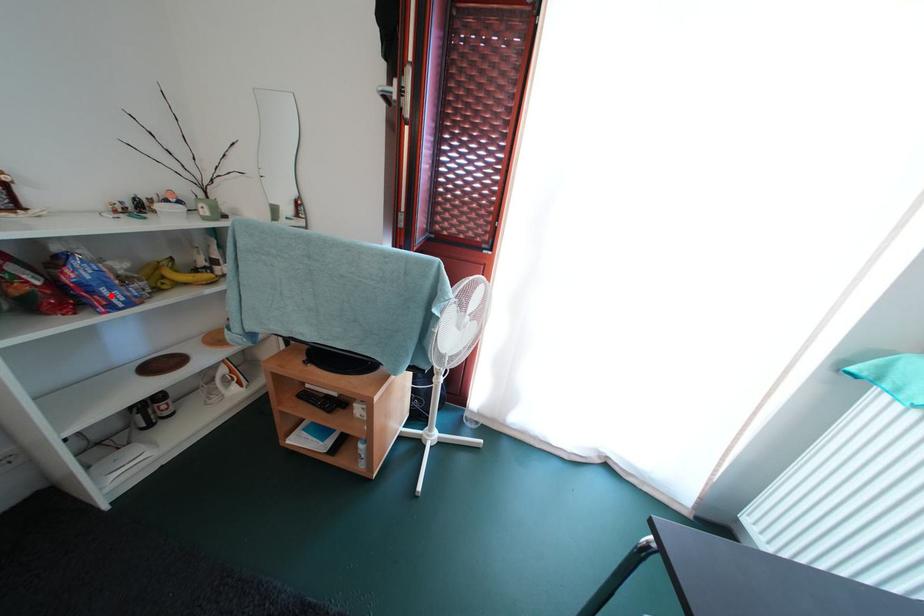
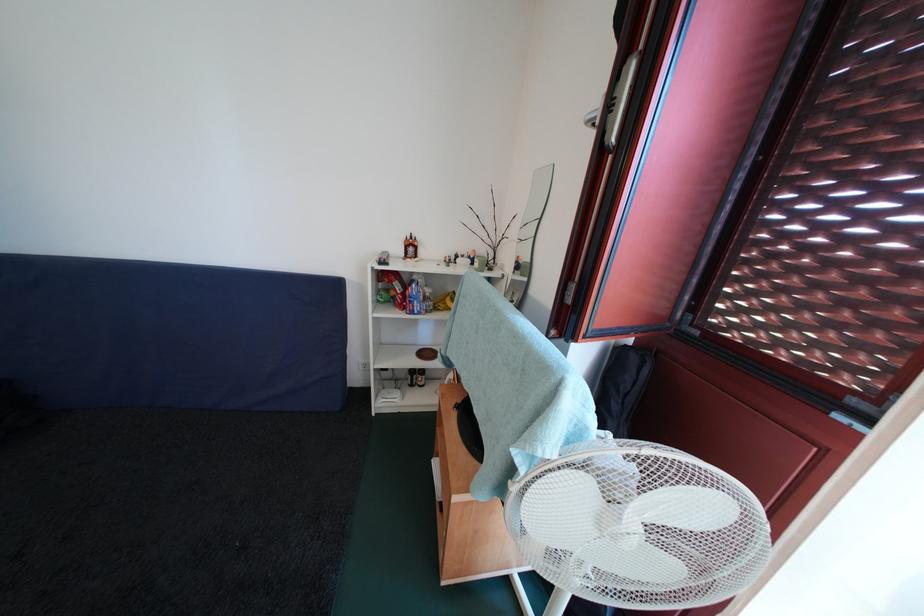
Question: I am providing you with two images of the same scene from different viewpoints. A red point is marked on the first image. Is the red point's position out of view in image 2?

Choices:
 (A) Yes
 (B) No

Answer: (B)